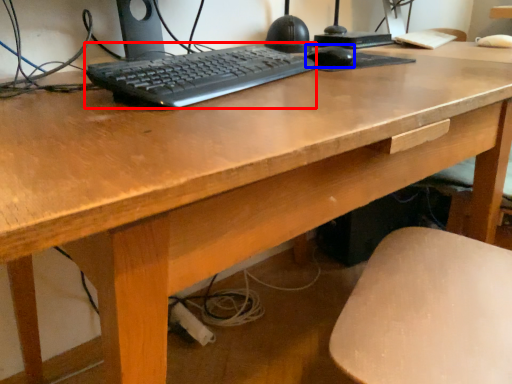
Question: Which of the following is the closest to the observer, computer keyboard (highlighted by a red box) or mouse (highlighted by a blue box)?

Choices:
 (A) computer keyboard
 (B) mouse

Answer: (A)